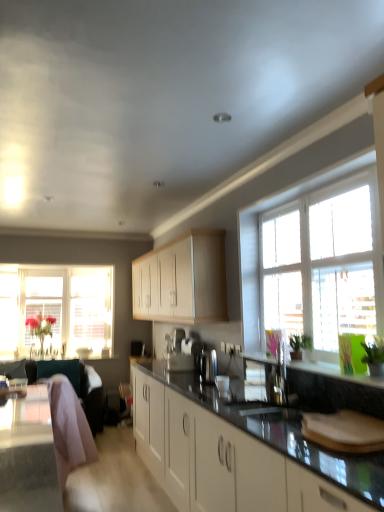
Measure the distance between point (156,292) and camera.

A distance of 4.44 meters exists between point (156,292) and camera.

This screenshot has width=384, height=512. Describe the element at coordinates (259, 241) in the screenshot. I see `clear glass window at right, the 2th window in the back-to-front sequence` at that location.

At what (x,y) coordinates should I click in order to perform the action: click on clear glass window at right, acting as the second window starting from the left. Please return your answer as a coordinate pair (x, y). This screenshot has height=512, width=384. Looking at the image, I should click on (259, 241).

Measure the distance between satin silver sink at center and camera.

satin silver sink at center and camera are 2.48 meters apart from each other.

What is the approximate width of satin silver sink at center?

It is 6.37 inches.

You are a GUI agent. You are given a task and a screenshot of the screen. Output one action in this format:
    pyautogui.click(x=<x>, y=<y>)
    Task: Click on the light wood cabinet at center
    Image resolution: width=384 pixels, height=512 pixels.
    Given the screenshot: What is the action you would take?
    pyautogui.click(x=182, y=280)

Is satin silver coffee machine at center in contact with wooden table at lower left?

satin silver coffee machine at center and wooden table at lower left are clearly separated.

In the scene shown: From a real-world perspective, is satin silver coffee machine at center over wooden table at lower left?

Yes, from a real-world perspective, satin silver coffee machine at center is above wooden table at lower left.

Between satin silver coffee machine at center and wooden table at lower left, which one has smaller width?

satin silver coffee machine at center is thinner.

Who is bigger, satin silver coffee machine at center or wooden table at lower left?

wooden table at lower left.

How far apart are satin silver coffee machine at center and translucent glass vase at left, the 2th window in the right-to-left sequence?

9.36 feet.

Does satin silver coffee machine at center appear on the left side of translucent glass vase at left, the 2th window in the right-to-left sequence?

In fact, satin silver coffee machine at center is to the right of translucent glass vase at left, the 2th window in the right-to-left sequence.

Is point (202, 376) closer to camera compared to point (8, 295)?

Yes, it is in front of point (8, 295).

In the scene shown: Considering the positions of objects satin silver coffee machine at center and translucent glass vase at left, the 2th window in the right-to-left sequence, in the image provided, who is in front, satin silver coffee machine at center or translucent glass vase at left, the 2th window in the right-to-left sequence,?

satin silver coffee machine at center is in front.

In the scene shown: Is translucent glass vase at left, arranged as the first window when viewed from the back, oriented away from clear glass window at right, acting as the second window starting from the left?

No, clear glass window at right, acting as the second window starting from the left, is not at the back of translucent glass vase at left, arranged as the first window when viewed from the back.

Is translucent glass vase at left, the 2th window positioned from the front, touching clear glass window at right, acting as the second window starting from the left?

No, translucent glass vase at left, the 2th window positioned from the front, is not next to clear glass window at right, acting as the second window starting from the left.

Considering the relative sizes of translucent glass vase at left, arranged as the first window when viewed from the back, and clear glass window at right, acting as the second window starting from the left, in the image provided, is translucent glass vase at left, arranged as the first window when viewed from the back, taller than clear glass window at right, acting as the second window starting from the left,?

Correct, translucent glass vase at left, arranged as the first window when viewed from the back, is much taller as clear glass window at right, acting as the second window starting from the left.

Is translucent glass vase at left, which ranks as the 1th window in left-to-right order, at the right side of clear glass window at right, the 1th window from the front?

No, translucent glass vase at left, which ranks as the 1th window in left-to-right order, is not to the right of clear glass window at right, the 1th window from the front.

Is pink fabric swivel chair at lower left, the first swivel chair when ordered from front to back, next to clear glass window at right, acting as the second window starting from the left?

No, pink fabric swivel chair at lower left, the first swivel chair when ordered from front to back, is not next to clear glass window at right, acting as the second window starting from the left.

From the image's perspective, which object appears higher, pink fabric swivel chair at lower left, arranged as the second swivel chair when viewed from the back, or clear glass window at right, acting as the second window starting from the left?

clear glass window at right, acting as the second window starting from the left, is shown above in the image.

Which is correct: pink fabric swivel chair at lower left, the first swivel chair when ordered from front to back, is inside clear glass window at right, the 1th window from the front, or outside of it?

pink fabric swivel chair at lower left, the first swivel chair when ordered from front to back, cannot be found inside clear glass window at right, the 1th window from the front.

In terms of size, does pink fabric swivel chair at lower left, the first swivel chair when ordered from front to back, appear bigger or smaller than clear glass window at right, acting as the second window starting from the left?

Clearly, pink fabric swivel chair at lower left, the first swivel chair when ordered from front to back, is larger in size than clear glass window at right, acting as the second window starting from the left.

Is pink fabric swivel chair at lower left, positioned as the 1th swivel chair in back-to-front order, looking in the opposite direction of wooden table at lower left?

No, pink fabric swivel chair at lower left, positioned as the 1th swivel chair in back-to-front order, is not facing the opposite direction of wooden table at lower left.

This screenshot has width=384, height=512. Find the location of `table above the pink fabric swivel chair at lower left, acting as the 2th swivel chair starting from the front (from a real-world perspective)`. table above the pink fabric swivel chair at lower left, acting as the 2th swivel chair starting from the front (from a real-world perspective) is located at coordinates (28, 454).

Considering the sizes of objects pink fabric swivel chair at lower left, acting as the 2th swivel chair starting from the front, and wooden table at lower left in the image provided, who is wider, pink fabric swivel chair at lower left, acting as the 2th swivel chair starting from the front, or wooden table at lower left?

pink fabric swivel chair at lower left, acting as the 2th swivel chair starting from the front.

Can you tell me how much pink fabric swivel chair at lower left, positioned as the 1th swivel chair in back-to-front order, and wooden table at lower left differ in facing direction?

91.1 degrees separate the facing orientations of pink fabric swivel chair at lower left, positioned as the 1th swivel chair in back-to-front order, and wooden table at lower left.

How many degrees apart are the facing directions of translucent glass vase at left, which ranks as the 1th window in left-to-right order, and light wood cabinet at center?

88.7 degrees separate the facing orientations of translucent glass vase at left, which ranks as the 1th window in left-to-right order, and light wood cabinet at center.

Measure the distance from translucent glass vase at left, arranged as the first window when viewed from the back, to light wood cabinet at center.

2.00 meters.

Based on their sizes in the image, would you say translucent glass vase at left, the 2th window positioned from the front, is bigger or smaller than light wood cabinet at center?

Considering their sizes, translucent glass vase at left, the 2th window positioned from the front, takes up less space than light wood cabinet at center.

Can you confirm if translucent glass vase at left, which ranks as the 1th window in left-to-right order, is wider than light wood cabinet at center?

No, translucent glass vase at left, which ranks as the 1th window in left-to-right order, is not wider than light wood cabinet at center.

Do you think translucent glass vase at left, which ranks as the 1th window in left-to-right order, is within pink fabric swivel chair at lower left, the first swivel chair when ordered from front to back, or outside of it?

translucent glass vase at left, which ranks as the 1th window in left-to-right order, cannot be found inside pink fabric swivel chair at lower left, the first swivel chair when ordered from front to back.

From the image's perspective, between translucent glass vase at left, which ranks as the 1th window in left-to-right order, and pink fabric swivel chair at lower left, the first swivel chair when ordered from front to back, who is located below?

From the image's view, pink fabric swivel chair at lower left, the first swivel chair when ordered from front to back, is below.

Considering the sizes of objects translucent glass vase at left, the 2th window in the right-to-left sequence, and pink fabric swivel chair at lower left, arranged as the second swivel chair when viewed from the back, in the image provided, who is taller, translucent glass vase at left, the 2th window in the right-to-left sequence, or pink fabric swivel chair at lower left, arranged as the second swivel chair when viewed from the back,?

translucent glass vase at left, the 2th window in the right-to-left sequence, is taller.

Which is behind, point (71, 305) or point (53, 383)?

Point (71, 305)

This screenshot has height=512, width=384. What are the coordinates of `table below the satin silver coffee machine at center (from a real-world perspective)` in the screenshot? It's located at (28, 454).

Identify the location of coffee machine located in front of the translucent glass vase at left, the 2th window positioned from the front. 204,362.

When comparing their distances from pink fabric swivel chair at lower left, acting as the 2th swivel chair starting from the front, does satin silver sink at center or light wood cabinet at center seem closer?

The object closer to pink fabric swivel chair at lower left, acting as the 2th swivel chair starting from the front, is light wood cabinet at center.

When comparing their distances from clear glass window at right, the 2th window in the back-to-front sequence, does black glossy countertop at center or light wood cabinet at center seem closer?

The object closer to clear glass window at right, the 2th window in the back-to-front sequence, is light wood cabinet at center.

From the image, which object appears to be farther from satin silver sink at center, satin silver coffee machine at center or light wood cabinet at center?

The object further to satin silver sink at center is light wood cabinet at center.

Looking at the image, which one is located further to clear glass window at right, the 1th window from the front, satin silver sink at center or wooden table at lower left?

wooden table at lower left.

When comparing their distances from pink fabric swivel chair at lower left, positioned as the 1th swivel chair in back-to-front order, does black glossy countertop at center or clear glass window at right, acting as the second window starting from the left, seem further?

clear glass window at right, acting as the second window starting from the left, is further to pink fabric swivel chair at lower left, positioned as the 1th swivel chair in back-to-front order.

Looking at the image, which one is located further to clear glass window at right, the 2th window in the back-to-front sequence, light wood cabinet at center or pink fabric swivel chair at lower left, arranged as the second swivel chair when viewed from the back?

pink fabric swivel chair at lower left, arranged as the second swivel chair when viewed from the back, is further to clear glass window at right, the 2th window in the back-to-front sequence.

When comparing their distances from satin silver coffee machine at center, does light wood cabinet at center or black glossy countertop at center seem closer?

light wood cabinet at center lies closer to satin silver coffee machine at center than the other object.

Considering their positions, is satin silver coffee machine at center positioned closer to translucent glass vase at left, the 2th window in the right-to-left sequence, than satin silver sink at center?

Based on the image, satin silver coffee machine at center appears to be nearer to translucent glass vase at left, the 2th window in the right-to-left sequence.

Where is `sink between wooden table at lower left and clear glass window at right, the 1th window from the front, from left to right`? The image size is (384, 512). sink between wooden table at lower left and clear glass window at right, the 1th window from the front, from left to right is located at coordinates click(x=268, y=380).

I want to click on window between black glossy countertop at center and light wood cabinet at center from front to back, so click(259, 241).

In order to click on sink between black glossy countertop at center and pink fabric swivel chair at lower left, arranged as the second swivel chair when viewed from the back, in the front-back direction in this screenshot , I will do `click(268, 380)`.

Find the location of `sink positioned between wooden table at lower left and translucent glass vase at left, the 2th window positioned from the front, from near to far`. sink positioned between wooden table at lower left and translucent glass vase at left, the 2th window positioned from the front, from near to far is located at coordinates (268, 380).